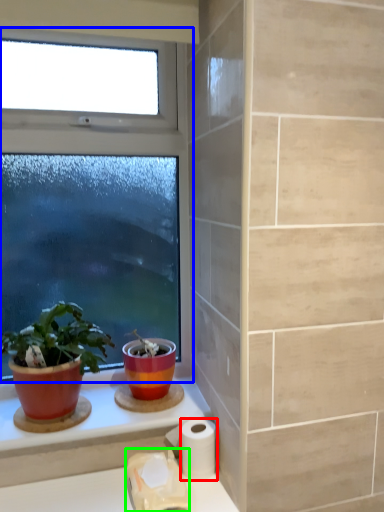
Question: Which object is the farthest from toilet paper (highlighted by a red box)? Choose among these: window (highlighted by a blue box) or toilet paper (highlighted by a green box).

Choices:
 (A) window
 (B) toilet paper

Answer: (A)